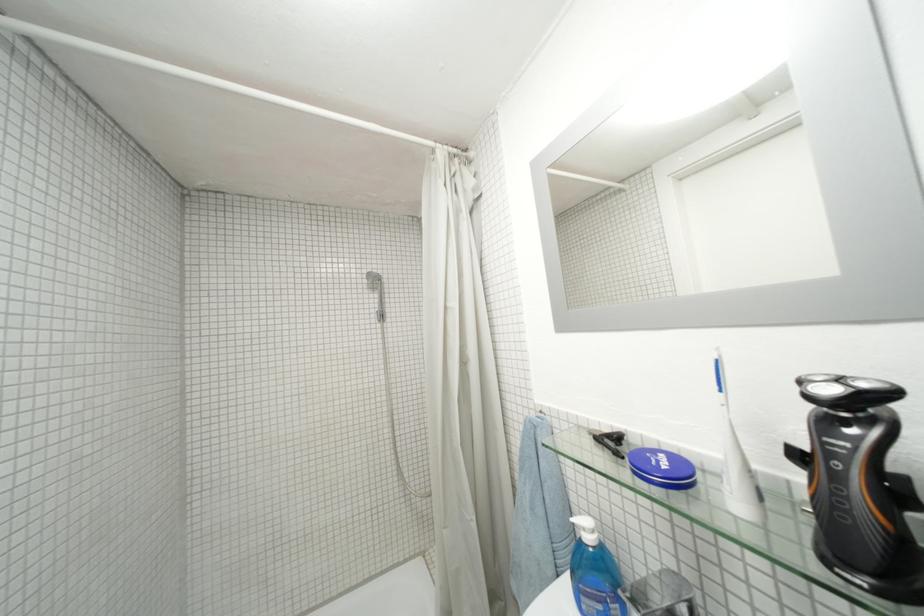
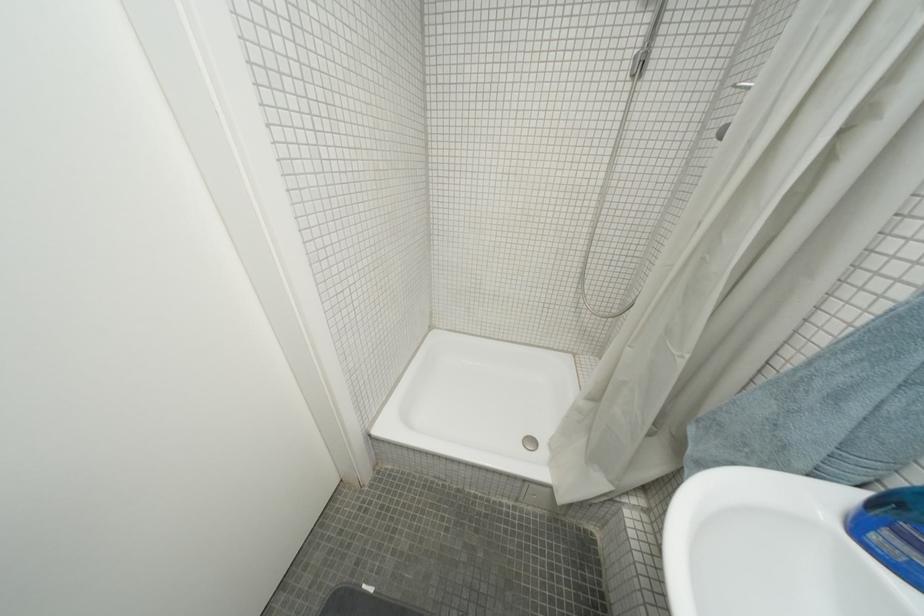
Find the pixel in the second image that matches (x=482, y=521) in the first image.

(697, 359)